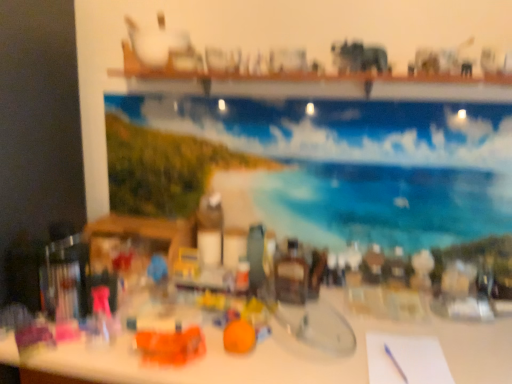
Measure the distance between point (451, 333) and camera.

The distance of point (451, 333) from camera is 4.42 feet.

What do you see at coordinates (297, 354) in the screenshot? This screenshot has width=512, height=384. I see `white glossy table at center` at bounding box center [297, 354].

This screenshot has height=384, width=512. What do you see at coordinates (406, 359) in the screenshot?
I see `white paper at lower right` at bounding box center [406, 359].

Locate an element on the screen. white paper at lower right is located at coordinates (406, 359).

You are a GUI agent. You are given a task and a screenshot of the screen. Output one action in this format:
    pyautogui.click(x=<x>, y=<y>)
    Task: Click on the orange matte toy at center, which is the 2th toy from left to right
    
    Given the screenshot: What is the action you would take?
    pyautogui.click(x=239, y=336)

This screenshot has width=512, height=384. What do you see at coordinates (360, 165) in the screenshot?
I see `blue glossy painting at upper center` at bounding box center [360, 165].

This screenshot has width=512, height=384. Identify the location of white glossy table at center. (297, 354).

Is white paper at lower right closer to the viewer compared to white glossy table at center?

No, it is behind white glossy table at center.

Can you confirm if white paper at lower right is bigger than white glossy table at center?

Actually, white paper at lower right might be smaller than white glossy table at center.

From the image's perspective, who appears lower, white paper at lower right or white glossy table at center?

white glossy table at center appears lower in the image.

Can we say white paper at lower right lies outside white glossy table at center?

Actually, white paper at lower right is within white glossy table at center.

How different are the orientations of white glossy table at center and blue glossy painting at upper center in degrees?

The facing directions of white glossy table at center and blue glossy painting at upper center are 0.685 degrees apart.

Do you think white glossy table at center is within blue glossy painting at upper center, or outside of it?

white glossy table at center is not enclosed by blue glossy painting at upper center.

Is white glossy table at center next to blue glossy painting at upper center and touching it?

No, white glossy table at center is not next to blue glossy painting at upper center.

Does white glossy table at center turn towards blue glossy painting at upper center?

No.

Is orange matte toy at center, which is counted as the first toy, starting from the right, spatially inside white paper at lower right, or outside of it?

orange matte toy at center, which is counted as the first toy, starting from the right, is located beyond the bounds of white paper at lower right.

Is orange matte toy at center, which is the 2th toy from left to right, shorter than white paper at lower right?

Incorrect, the height of orange matte toy at center, which is the 2th toy from left to right, does not fall short of that of white paper at lower right.

From a real-world perspective, does orange matte toy at center, which is counted as the first toy, starting from the right, stand above white paper at lower right?

Indeed, from a real-world perspective, orange matte toy at center, which is counted as the first toy, starting from the right, stands above white paper at lower right.

Based on the photo, between blue glossy painting at upper center and white glossy table at center, which one has smaller size?

blue glossy painting at upper center is smaller.

Which is behind, blue glossy painting at upper center or white glossy table at center?

blue glossy painting at upper center is further away from the camera.

Would you say blue glossy painting at upper center is inside or outside white glossy table at center?

blue glossy painting at upper center lies outside white glossy table at center.

From the image's perspective, is blue glossy painting at upper center beneath white glossy table at center?

No, from the image's perspective, blue glossy painting at upper center is not below white glossy table at center.

Between orange plastic toy at center, which is the 2th toy from right to left, and orange matte toy at center, which is the 2th toy from left to right, which one has less height?

orange plastic toy at center, which is the 2th toy from right to left, is shorter.

From the image's perspective, between orange plastic toy at center, which is the 2th toy from right to left, and orange matte toy at center, which is counted as the first toy, starting from the right, who is located below?

orange plastic toy at center, which is the 2th toy from right to left.

Looking at their sizes, would you say orange plastic toy at center, placed as the first toy when sorted from left to right, is wider or thinner than orange matte toy at center, which is the 2th toy from left to right?

orange plastic toy at center, placed as the first toy when sorted from left to right, is wider than orange matte toy at center, which is the 2th toy from left to right.

Which is more to the left, orange plastic toy at center, placed as the first toy when sorted from left to right, or orange matte toy at center, which is the 2th toy from left to right?

orange plastic toy at center, placed as the first toy when sorted from left to right.

Does white paper at lower right appear on the right side of blue glossy painting at upper center?

Correct, you'll find white paper at lower right to the right of blue glossy painting at upper center.

Which is less distant, (371, 352) or (284, 140)?

Point (371, 352).

You are a GUI agent. You are given a task and a screenshot of the screen. Output one action in this format:
    pyautogui.click(x=<x>, y=<y>)
    Task: Click on the swimming pool above the white paper at lower right (from the image's perspective)
    Image resolution: width=512 pixels, height=384 pixels.
    Given the screenshot: What is the action you would take?
    pyautogui.click(x=360, y=165)

How distant is white paper at lower right from blue glossy painting at upper center?

white paper at lower right and blue glossy painting at upper center are 25.61 inches apart.

Considering the positions of objects white glossy table at center and white paper at lower right in the image provided, who is in front, white glossy table at center or white paper at lower right?

white glossy table at center is in front.

From a real-world perspective, which object rests below the other?

white glossy table at center.

From the image's perspective, which is below, white glossy table at center or white paper at lower right?

white glossy table at center.

Which object is thinner, white glossy table at center or white paper at lower right?

With smaller width is white paper at lower right.

Find the location of a particular element. table that is below the white paper at lower right (from the image's perspective) is located at coordinates [x=297, y=354].

The width and height of the screenshot is (512, 384). Identify the location of swimming pool above the white glossy table at center (from the image's perspective). (360, 165).

From the image, which object appears to be nearer to orange matte toy at center, which is the 2th toy from left to right, white glossy table at center or white paper at lower right?

Among the two, white glossy table at center is located nearer to orange matte toy at center, which is the 2th toy from left to right.

Looking at the image, which one is located closer to blue glossy painting at upper center, orange matte toy at center, which is the 2th toy from left to right, or white glossy table at center?

The object closer to blue glossy painting at upper center is white glossy table at center.

Considering their positions, is orange plastic toy at center, placed as the first toy when sorted from left to right, positioned closer to white glossy table at center than white paper at lower right?

Based on the image, white paper at lower right appears to be nearer to white glossy table at center.

From the image, which object appears to be nearer to white glossy table at center, orange matte toy at center, which is the 2th toy from left to right, or orange plastic toy at center, which is the 2th toy from right to left?

orange plastic toy at center, which is the 2th toy from right to left, is positioned closer to the anchor white glossy table at center.

Which object lies nearer to the anchor point white glossy table at center, white paper at lower right or blue glossy painting at upper center?

white paper at lower right is positioned closer to the anchor white glossy table at center.

From the image, which object appears to be nearer to white glossy table at center, white paper at lower right or orange matte toy at center, which is the 2th toy from left to right?

Among the two, white paper at lower right is located nearer to white glossy table at center.

Based on their spatial positions, is orange plastic toy at center, which is the 2th toy from right to left, or white glossy table at center closer to white paper at lower right?

The object closer to white paper at lower right is white glossy table at center.

Considering their positions, is orange matte toy at center, which is the 2th toy from left to right, positioned closer to white glossy table at center than blue glossy painting at upper center?

Among the two, orange matte toy at center, which is the 2th toy from left to right, is located nearer to white glossy table at center.

Locate an element on the screen. The image size is (512, 384). notepad between blue glossy painting at upper center and white glossy table at center in the vertical direction is located at coordinates (406, 359).

Identify the location of swimming pool between orange plastic toy at center, placed as the first toy when sorted from left to right, and white paper at lower right. The image size is (512, 384). (360, 165).

You are a GUI agent. You are given a task and a screenshot of the screen. Output one action in this format:
    pyautogui.click(x=<x>, y=<y>)
    Task: Click on the toy between orange plastic toy at center, placed as the first toy when sorted from left to right, and white paper at lower right
    Image resolution: width=512 pixels, height=384 pixels.
    Given the screenshot: What is the action you would take?
    pyautogui.click(x=239, y=336)

Where is `toy between orange matte toy at center, which is the 2th toy from left to right, and white glossy table at center vertically`? The width and height of the screenshot is (512, 384). toy between orange matte toy at center, which is the 2th toy from left to right, and white glossy table at center vertically is located at coordinates (170, 345).